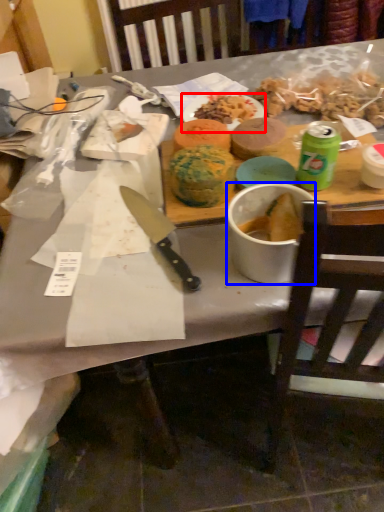
Question: Which of the following is the farthest to the observer, plate (highlighted by a red box) or bowl (highlighted by a blue box)?

Choices:
 (A) plate
 (B) bowl

Answer: (A)